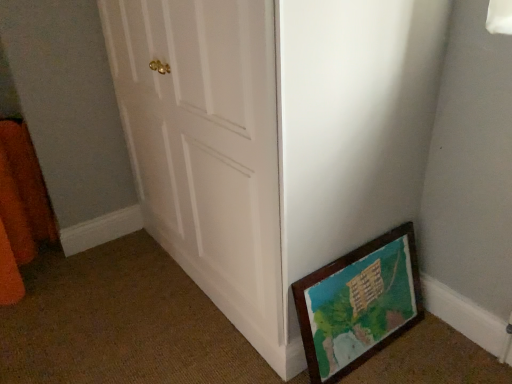
In order to click on free space that is in between white wooden door at center and orange fuzzy curtain at left in this screenshot , I will do `click(136, 295)`.